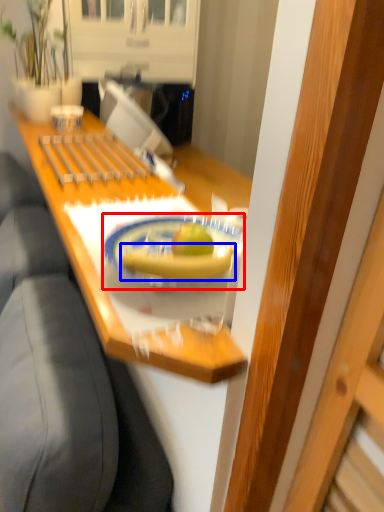
Question: Which of the following is the closest to the observer, plate (highlighted by a red box) or banana (highlighted by a blue box)?

Choices:
 (A) plate
 (B) banana

Answer: (A)